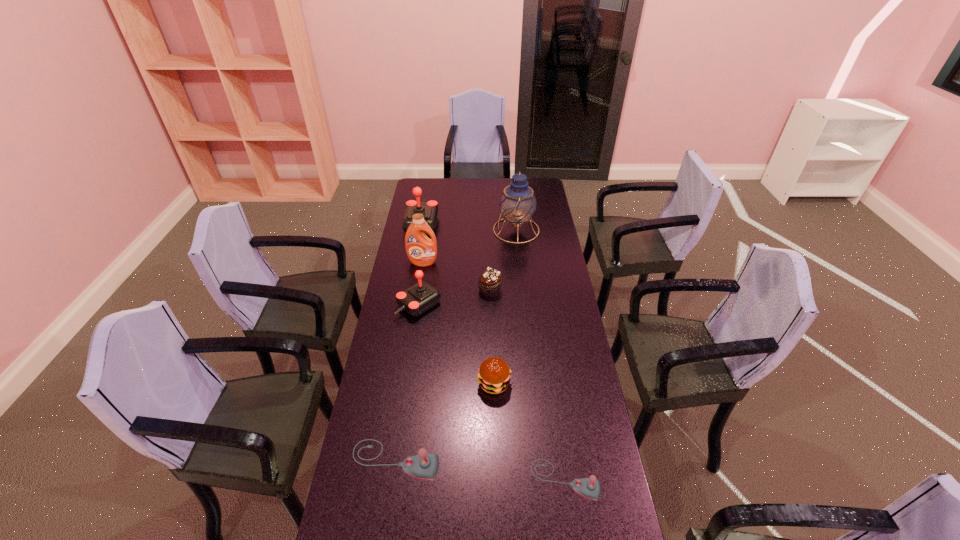
Find the location of a particular element. brown hamburger is located at coordinates (494, 375).

This screenshot has height=540, width=960. What are the coordinates of `the third tallest joystick` in the screenshot? It's located at (424, 466).

Where is `the bigger gray joystick`? the bigger gray joystick is located at coordinates (424, 466).

Locate an element on the screen. The height and width of the screenshot is (540, 960). the smaller gray joystick is located at coordinates (590, 488).

Identify the location of the shortest joystick. (590, 488).

Where is `vacant space located on the front-facing side of the lantern`? vacant space located on the front-facing side of the lantern is located at coordinates (441, 230).

The height and width of the screenshot is (540, 960). I want to click on vacant region located on the front-facing side of the lantern, so click(475, 230).

Identify the location of vacant space situated 0.140m on the front-facing side of the lantern. The image size is (960, 540). (466, 230).

What are the coordinates of `vacant space located on the front-facing side of the third farthest object` in the screenshot? It's located at point(418,296).

Find the location of a particular element. The width and height of the screenshot is (960, 540). vacant space located on the front of the third tallest object is located at coordinates (411, 284).